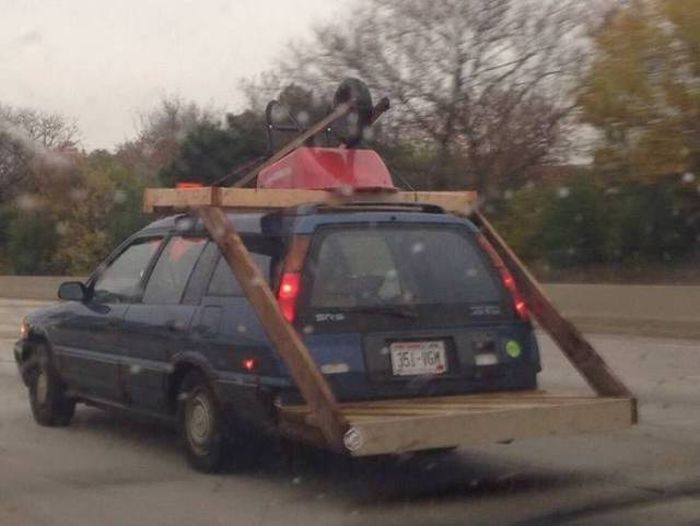
Where is `sticker`? This screenshot has height=526, width=700. sticker is located at coordinates (514, 349).